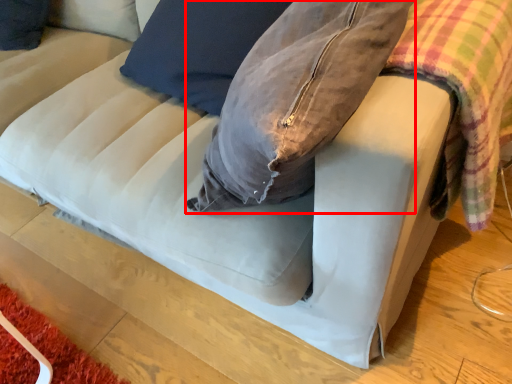
Question: Considering the relative positions of bean bag chair (annotated by the red box) and plaid in the image provided, where is bean bag chair (annotated by the red box) located with respect to the staircase?

Choices:
 (A) left
 (B) right

Answer: (A)